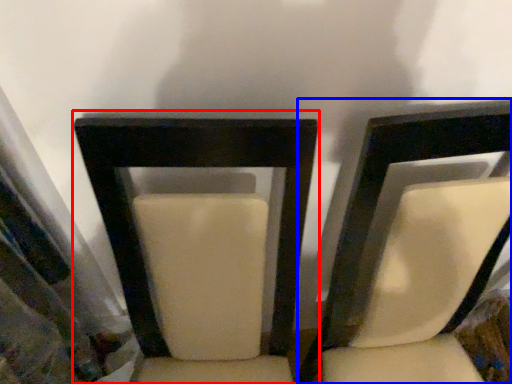
Question: Which point is closer to the camera, chair (highlighted by a red box) or chair (highlighted by a blue box)?

Choices:
 (A) chair
 (B) chair

Answer: (A)